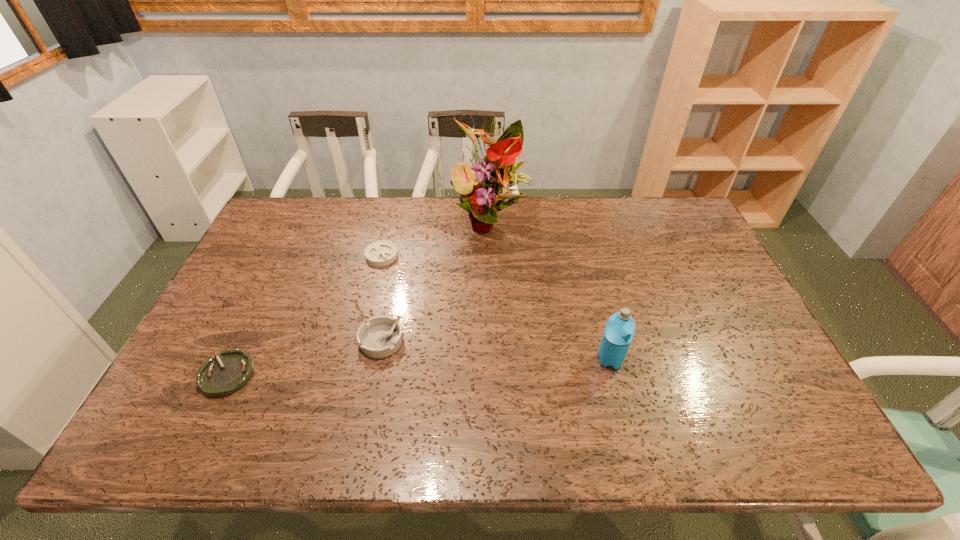
Locate an element on the screen. The height and width of the screenshot is (540, 960). object that is the closest to the thermos bottle is located at coordinates (491, 177).

The image size is (960, 540). I want to click on ashtray that is the second closest to the second object from right to left, so click(381, 337).

Locate an element on the screen. ashtray that stands as the closest to the bouquet is located at coordinates (380, 253).

Find the location of a particular element. free space that satisfies the following two spatial constraints: 1. on the back side of the farthest ashtray; 2. on the right side of the leftmost object is located at coordinates (285, 255).

The height and width of the screenshot is (540, 960). In order to click on vacant point that satisfies the following two spatial constraints: 1. on the back side of the leftmost ashtray; 2. on the right side of the thermos bottle in this screenshot , I will do `click(235, 359)`.

Find the location of a particular element. vacant area that satisfies the following two spatial constraints: 1. on the front-facing side of the bouquet; 2. on the right side of the fourth shortest object is located at coordinates (493, 359).